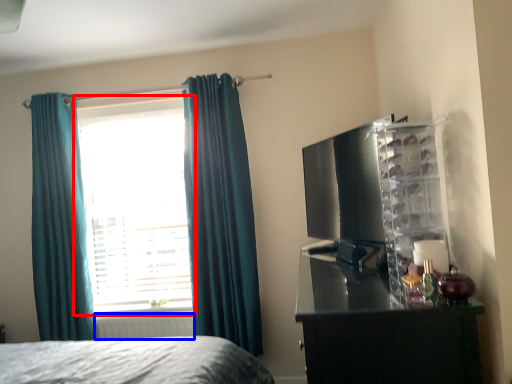
Question: Which point is further to the camera, window (highlighted by a red box) or radiator (highlighted by a blue box)?

Choices:
 (A) window
 (B) radiator

Answer: (A)